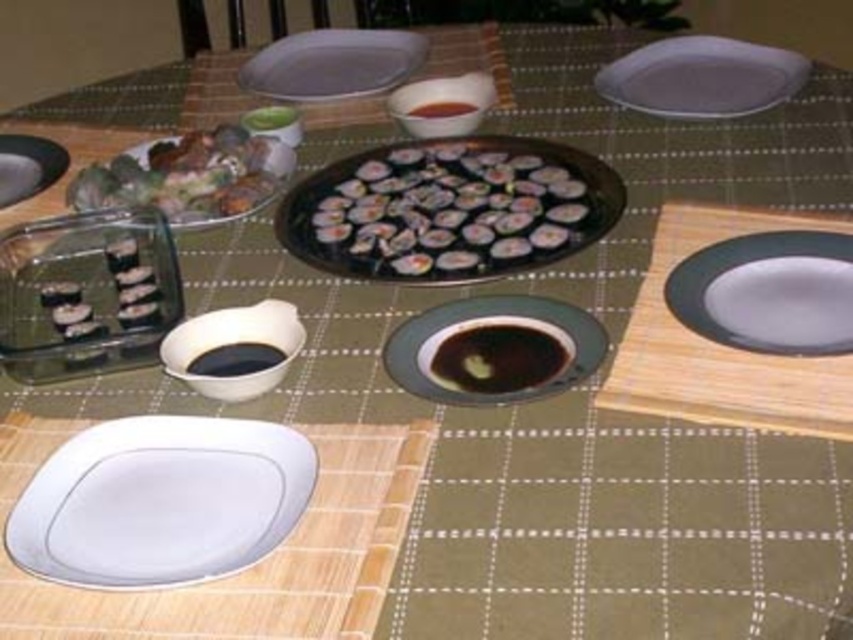
You are a guest at a sushi dinner and need to place your chopsticks on the table. The host mentioned that the chopsticks should be placed near the white glossy plate at lower left. Based on the table layout described, where should you place your chopsticks in terms of direction and proximity?

The white glossy plate at lower left is located at coordinates approximately 0.784 on the x axis and 0.189 on the y axis. Since the coordinates are relative to the table surface, placing the chopsticks near this point would mean positioning them towards the lower left area of the table, close to the white glossy plate at lower left.

You are a guest at a sushi dinner. You see the clear plastic tray at left and the black glossy soy sauce at center. Which container can hold more soy sauce?

The clear plastic tray at left is larger in size than the black glossy soy sauce at center, so it can hold more soy sauce.